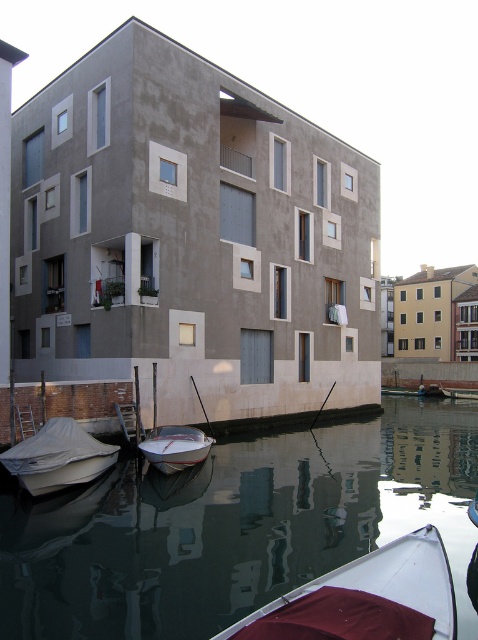
Is smooth reflective water at lower center below white glossy boat at lower center?

Yes, smooth reflective water at lower center is below white glossy boat at lower center.

Consider the image. Between smooth reflective water at lower center and white glossy boat at lower center, which one appears on the left side from the viewer's perspective?

white glossy boat at lower center is more to the left.

Is point (9, 584) less distant than point (196, 456)?

Yes, it is.

Locate an element on the screen. smooth reflective water at lower center is located at coordinates (236, 525).

Based on the photo, who is taller, smooth reflective water at lower center or white matte boat at lower right?

Standing taller between the two is smooth reflective water at lower center.

Is smooth reflective water at lower center further to camera compared to white matte boat at lower right?

Yes, it is.

This screenshot has width=478, height=640. Identify the location of smooth reflective water at lower center. (236, 525).

Where is `smooth reflective water at lower center`? The image size is (478, 640). smooth reflective water at lower center is located at coordinates (236, 525).

Does white matte boat at lower right have a smaller size compared to white glossy boat at lower center?

Indeed, white matte boat at lower right has a smaller size compared to white glossy boat at lower center.

Is white matte boat at lower right closer to the viewer compared to white glossy boat at lower center?

That is True.

The width and height of the screenshot is (478, 640). What do you see at coordinates (373, 592) in the screenshot?
I see `white matte boat at lower right` at bounding box center [373, 592].

The image size is (478, 640). Identify the location of white matte boat at lower right. (373, 592).